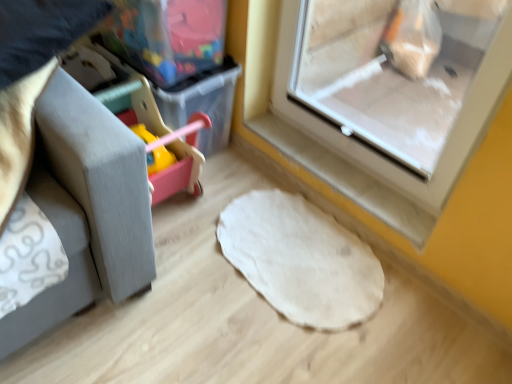
You are a GUI agent. You are given a task and a screenshot of the screen. Output one action in this format:
    pyautogui.click(x=<x>, y=<y>)
    Task: Click on the vacant area that lies in front of white felt mat at center
    
    Given the screenshot: What is the action you would take?
    pyautogui.click(x=276, y=346)